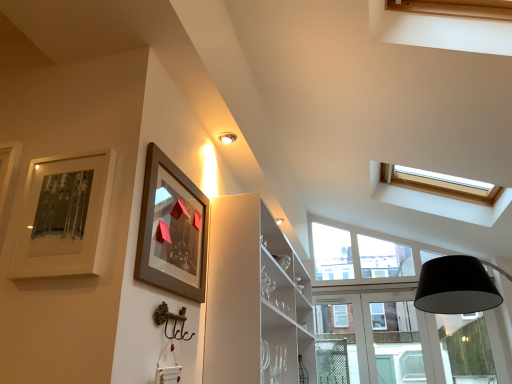
Describe the element at coordinates (64, 215) in the screenshot. I see `matte silver picture frame at upper left, the 1th picture frame from the left` at that location.

Image resolution: width=512 pixels, height=384 pixels. What do you see at coordinates (400, 313) in the screenshot?
I see `clear glass window at center` at bounding box center [400, 313].

This screenshot has width=512, height=384. What are the coordinates of `clear glass window at center` in the screenshot? It's located at click(x=400, y=313).

What is the approximate height of matte brown picture frame at upper left, acting as the first picture frame starting from the right?

matte brown picture frame at upper left, acting as the first picture frame starting from the right, is 19.82 inches in height.

Locate an element on the screen. The image size is (512, 384). matte silver picture frame at upper left, the 1th picture frame from the left is located at coordinates (64, 215).

Which is correct: matte silver picture frame at upper left, the 1th picture frame from the left, is inside matte brown picture frame at upper left, acting as the first picture frame starting from the right, or outside of it?

matte silver picture frame at upper left, the 1th picture frame from the left, lies outside matte brown picture frame at upper left, acting as the first picture frame starting from the right.

From the image's perspective, between matte silver picture frame at upper left, which appears as the 2th picture frame when viewed from the right, and matte brown picture frame at upper left, acting as the first picture frame starting from the right, which one is located above?

matte silver picture frame at upper left, which appears as the 2th picture frame when viewed from the right, appears higher in the image.

Considering the points (74, 242) and (204, 246), which point is in front, point (74, 242) or point (204, 246)?

Positioned in front is point (74, 242).

From a real-world perspective, which object stands above the other?

matte brown picture frame at upper left, acting as the first picture frame starting from the right, from a real-world perspective.

Is clear glass window at center positioned in front of matte brown picture frame at upper left, acting as the first picture frame starting from the right?

No, it is behind matte brown picture frame at upper left, acting as the first picture frame starting from the right.

Looking at this image, which is correct: clear glass window at center is inside matte brown picture frame at upper left, acting as the first picture frame starting from the right, or outside of it?

The correct answer is: outside.

In terms of width, does clear glass window at center look wider or thinner when compared to matte brown picture frame at upper left, which appears as the second picture frame when viewed from the left?

In the image, clear glass window at center appears to be wider than matte brown picture frame at upper left, which appears as the second picture frame when viewed from the left.

Considering the sizes of objects matte brown picture frame at upper left, acting as the first picture frame starting from the right, and matte silver picture frame at upper left, the 1th picture frame from the left, in the image provided, who is smaller, matte brown picture frame at upper left, acting as the first picture frame starting from the right, or matte silver picture frame at upper left, the 1th picture frame from the left,?

matte silver picture frame at upper left, the 1th picture frame from the left.

In the scene shown: Could you tell me if matte brown picture frame at upper left, which appears as the second picture frame when viewed from the left, is turned towards matte silver picture frame at upper left, the 1th picture frame from the left?

No, matte brown picture frame at upper left, which appears as the second picture frame when viewed from the left, is not facing towards matte silver picture frame at upper left, the 1th picture frame from the left.

Considering the relative sizes of matte brown picture frame at upper left, which appears as the second picture frame when viewed from the left, and matte silver picture frame at upper left, which appears as the 2th picture frame when viewed from the right, in the image provided, is matte brown picture frame at upper left, which appears as the second picture frame when viewed from the left, wider than matte silver picture frame at upper left, which appears as the 2th picture frame when viewed from the right,?

Yes.

Is matte brown picture frame at upper left, which appears as the second picture frame when viewed from the left, beside matte silver picture frame at upper left, which appears as the 2th picture frame when viewed from the right?

No, matte brown picture frame at upper left, which appears as the second picture frame when viewed from the left, is not touching matte silver picture frame at upper left, which appears as the 2th picture frame when viewed from the right.

Does matte silver picture frame at upper left, which appears as the 2th picture frame when viewed from the right, turn towards clear glass window at center?

No, matte silver picture frame at upper left, which appears as the 2th picture frame when viewed from the right, does not turn towards clear glass window at center.

Is the surface of matte silver picture frame at upper left, the 1th picture frame from the left, in direct contact with clear glass window at center?

They are not placed beside each other.

Is point (31, 201) farther from viewer compared to point (430, 319)?

No, it is not.

Between matte brown picture frame at upper left, which appears as the second picture frame when viewed from the left, and clear glass window at center, which one has larger size?

Bigger between the two is clear glass window at center.

From a real-world perspective, is matte brown picture frame at upper left, acting as the first picture frame starting from the right, on clear glass window at center?

Yes, from a real-world perspective, matte brown picture frame at upper left, acting as the first picture frame starting from the right, is on top of clear glass window at center.

Where is `window that appears below the matte brown picture frame at upper left, which appears as the second picture frame when viewed from the left (from the image's perspective)`? The height and width of the screenshot is (384, 512). window that appears below the matte brown picture frame at upper left, which appears as the second picture frame when viewed from the left (from the image's perspective) is located at coordinates pos(400,313).

Is matte brown picture frame at upper left, which appears as the second picture frame when viewed from the left, in front of or behind clear glass window at center in the image?

Clearly, matte brown picture frame at upper left, which appears as the second picture frame when viewed from the left, is in front of clear glass window at center.

From the image's perspective, is clear glass window at center below matte silver picture frame at upper left, which appears as the 2th picture frame when viewed from the right?

Correct, clear glass window at center appears lower than matte silver picture frame at upper left, which appears as the 2th picture frame when viewed from the right, in the image.

Between clear glass window at center and matte silver picture frame at upper left, the 1th picture frame from the left, which one has more height?

With more height is clear glass window at center.

Is clear glass window at center not close to matte silver picture frame at upper left, which appears as the 2th picture frame when viewed from the right?

Yes, clear glass window at center is far from matte silver picture frame at upper left, which appears as the 2th picture frame when viewed from the right.

Based on the photo, can you confirm if clear glass window at center is bigger than matte silver picture frame at upper left, which appears as the 2th picture frame when viewed from the right?

Correct, clear glass window at center is larger in size than matte silver picture frame at upper left, which appears as the 2th picture frame when viewed from the right.

Image resolution: width=512 pixels, height=384 pixels. I want to click on picture frame in front of the matte brown picture frame at upper left, which appears as the second picture frame when viewed from the left, so click(64, 215).

The width and height of the screenshot is (512, 384). In the image, there is a matte brown picture frame at upper left, acting as the first picture frame starting from the right. In order to click on window below it (from a real-world perspective) in this screenshot , I will do `click(400, 313)`.

Based on their spatial positions, is matte silver picture frame at upper left, the 1th picture frame from the left, or clear glass window at center further from matte brown picture frame at upper left, which appears as the second picture frame when viewed from the left?

clear glass window at center.

Consider the image. When comparing their distances from clear glass window at center, does matte brown picture frame at upper left, which appears as the second picture frame when viewed from the left, or matte silver picture frame at upper left, the 1th picture frame from the left, seem closer?

matte brown picture frame at upper left, which appears as the second picture frame when viewed from the left, lies closer to clear glass window at center than the other object.

Estimate the real-world distances between objects in this image. Which object is further from matte brown picture frame at upper left, which appears as the second picture frame when viewed from the left, clear glass window at center or matte silver picture frame at upper left, which appears as the 2th picture frame when viewed from the right?

The object further to matte brown picture frame at upper left, which appears as the second picture frame when viewed from the left, is clear glass window at center.

Looking at the image, which one is located further to matte silver picture frame at upper left, which appears as the 2th picture frame when viewed from the right, matte brown picture frame at upper left, acting as the first picture frame starting from the right, or clear glass window at center?

clear glass window at center is positioned further to the anchor matte silver picture frame at upper left, which appears as the 2th picture frame when viewed from the right.

When comparing their distances from clear glass window at center, does matte silver picture frame at upper left, the 1th picture frame from the left, or matte brown picture frame at upper left, acting as the first picture frame starting from the right, seem closer?

matte brown picture frame at upper left, acting as the first picture frame starting from the right.

Considering their positions, is clear glass window at center positioned further to matte silver picture frame at upper left, which appears as the 2th picture frame when viewed from the right, than matte brown picture frame at upper left, acting as the first picture frame starting from the right?

The object further to matte silver picture frame at upper left, which appears as the 2th picture frame when viewed from the right, is clear glass window at center.

Identify the location of picture frame between matte silver picture frame at upper left, the 1th picture frame from the left, and clear glass window at center from front to back. (172, 229).